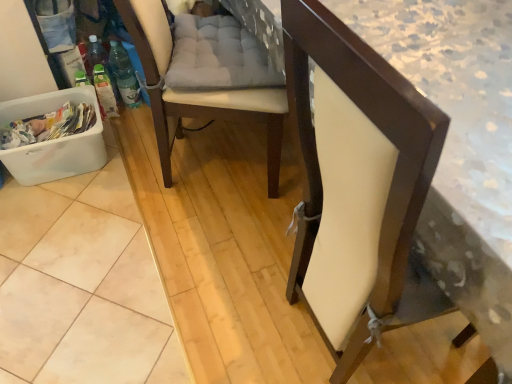
You are a GUI agent. You are given a task and a screenshot of the screen. Output one action in this format:
    pyautogui.click(x=<x>, y=<y>)
    Task: Click on the free space in front of white leather chair at center, which is the first chair from left to right
    The height and width of the screenshot is (384, 512).
    Given the screenshot: What is the action you would take?
    pyautogui.click(x=177, y=259)